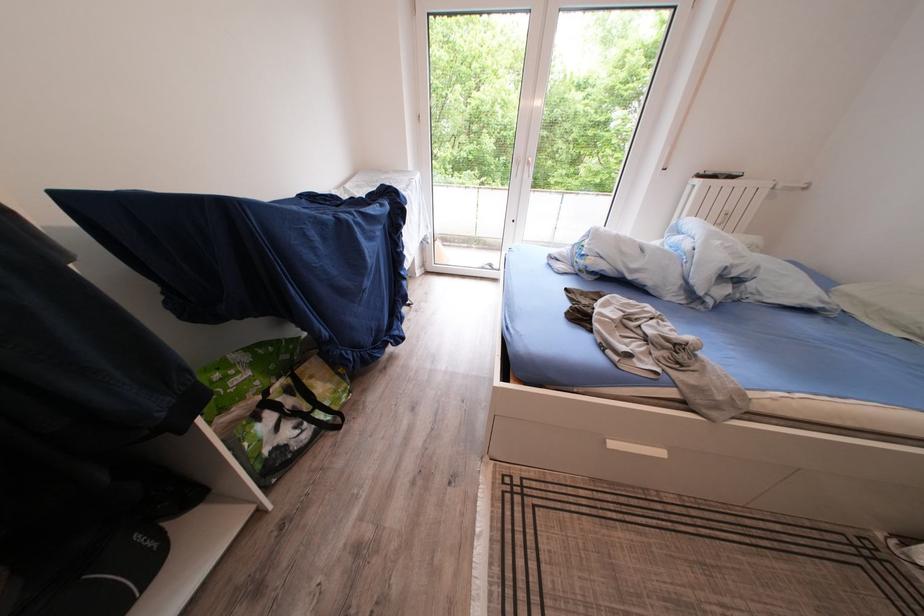
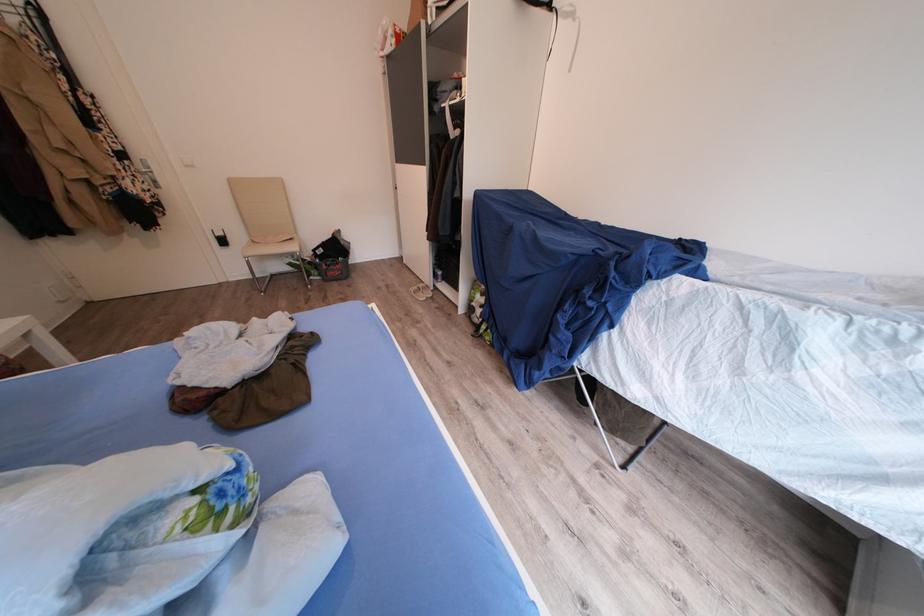
Locate, in the second image, the point that corresponds to (x=591, y=251) in the first image.

(213, 507)